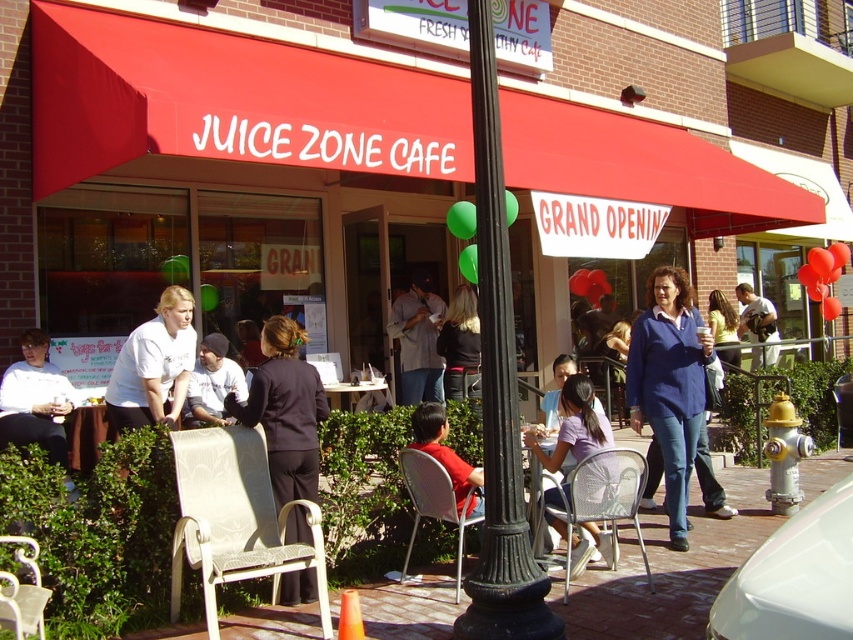
You are a customer at Juice Zone Cafe and want to sit down. You see a white wicker chair at center and a matte black blazer at center. Which object is more suitable for sitting?

The white wicker chair at center is more suitable for sitting since it is designed for seating, while the matte black blazer at center is likely a clothing item and not meant for sitting.